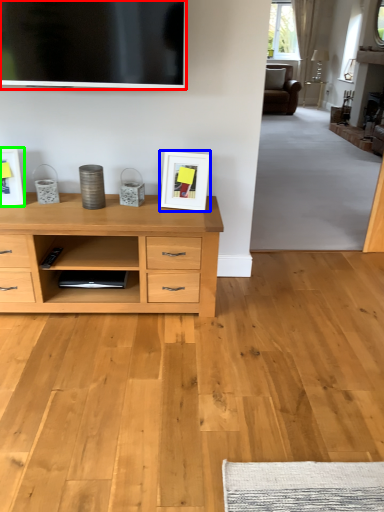
Question: Which object is the farthest from television (highlighted by a red box)? Choose among these: picture frame (highlighted by a blue box) or picture frame (highlighted by a green box).

Choices:
 (A) picture frame
 (B) picture frame

Answer: (B)